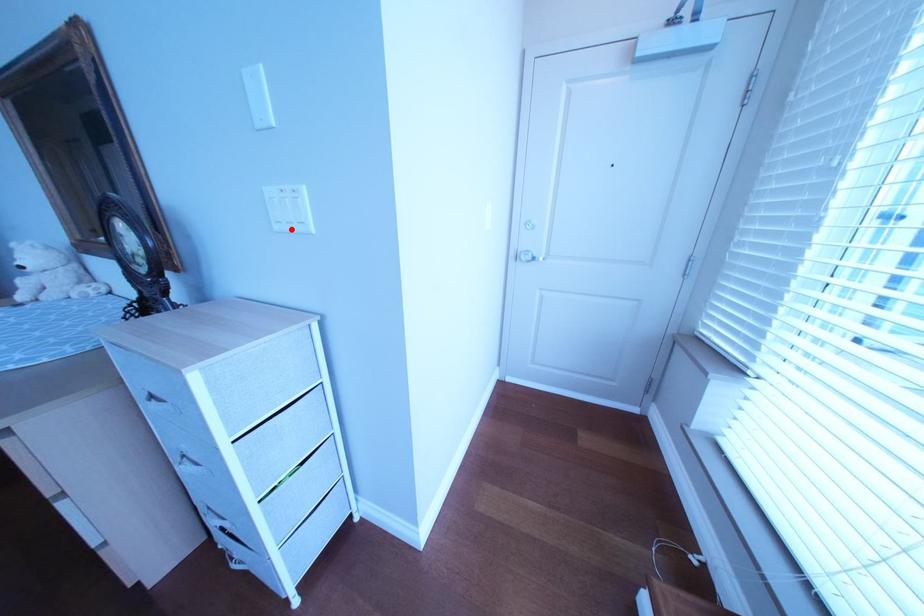
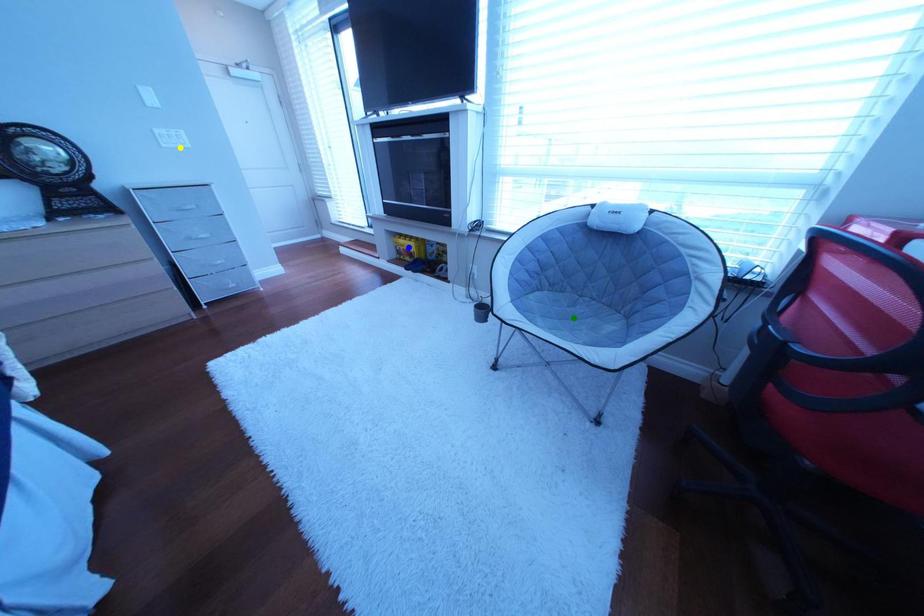
Question: I am providing you with two images of the same scene from different viewpoints. A red point is marked on the first image. You are given multiple points on the second image. In image 2, which mark is for the same physical point as the one in image 1?

Choices:
 (A) green point
 (B) yellow point
 (C) blue point

Answer: (B)